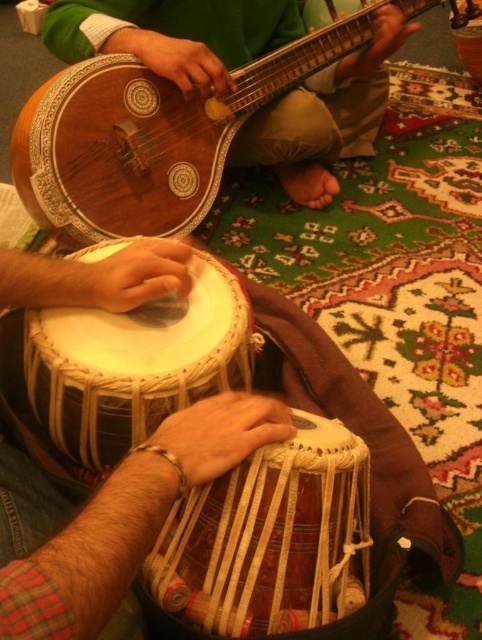
Is wooden guitar at upper left in front of brown woven drum at center?

No, it is behind brown woven drum at center.

Locate an element on the screen. wooden guitar at upper left is located at coordinates (151, 134).

Is point (94, 128) farther from viewer compared to point (204, 564)?

Yes, point (94, 128) is behind point (204, 564).

Find the location of a particular element. The width and height of the screenshot is (482, 640). wooden guitar at upper left is located at coordinates (151, 134).

Does brown woven drum at center appear over white woven drum at center?

No, brown woven drum at center is not above white woven drum at center.

This screenshot has width=482, height=640. What do you see at coordinates (270, 538) in the screenshot?
I see `brown woven drum at center` at bounding box center [270, 538].

Is point (210, 596) closer to viewer compared to point (231, 278)?

Yes, it is.

Locate an element on the screen. The image size is (482, 640). brown woven drum at center is located at coordinates (270, 538).

Is point (51, 104) positioned before point (223, 292)?

No, (51, 104) is further to viewer.

Locate an element on the screen. The height and width of the screenshot is (640, 482). wooden guitar at upper left is located at coordinates (151, 134).

Who is more forward, [99,208] or [95,444]?

Point [95,444]

This screenshot has height=640, width=482. In order to click on wooden guitar at upper left in this screenshot , I will do coord(151,134).